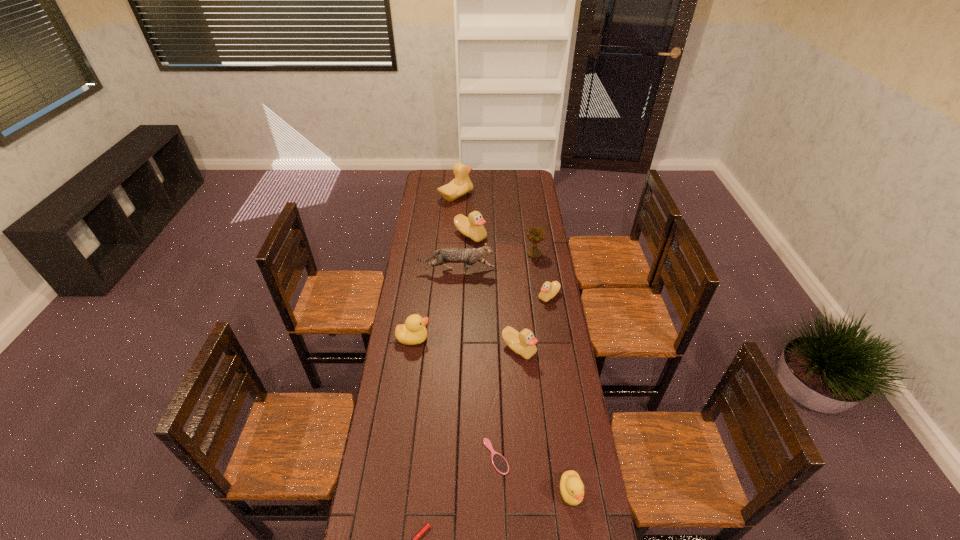
Find the location of a particular element. Image resolution: width=960 pixels, height=540 pixels. object that is positioned at the far left corner is located at coordinates (461, 184).

In the image, there is a desktop. Where is `vacant space at the far edge`? vacant space at the far edge is located at coordinates (492, 173).

I want to click on vacant point at the left edge, so click(418, 206).

At what (x,y) coordinates should I click in order to perform the action: click on vacant space at the right edge of the desktop. Please return your answer as a coordinate pair (x, y). Looking at the image, I should click on (535, 310).

The height and width of the screenshot is (540, 960). I want to click on vacant space that is in between the hairbrush and the chalice, so click(516, 355).

Identify the location of free area in between the cat and the third beige duck from left to right. (488, 310).

Find the location of a particular element. Image resolution: width=960 pixels, height=540 pixels. empty space between the smallest beige duck and the chalice is located at coordinates (541, 275).

Where is `vacant space that is in between the cat and the second nearest beige duck`? vacant space that is in between the cat and the second nearest beige duck is located at coordinates (503, 284).

Where is `vacant space in between the tallest object and the red chalice`? This screenshot has width=960, height=540. vacant space in between the tallest object and the red chalice is located at coordinates (495, 225).

At what (x,y) coordinates should I click in order to perform the action: click on empty space between the left yellow duck and the third duck from right to left. Please return your answer as a coordinate pair (x, y). This screenshot has height=540, width=960. Looking at the image, I should click on (466, 343).